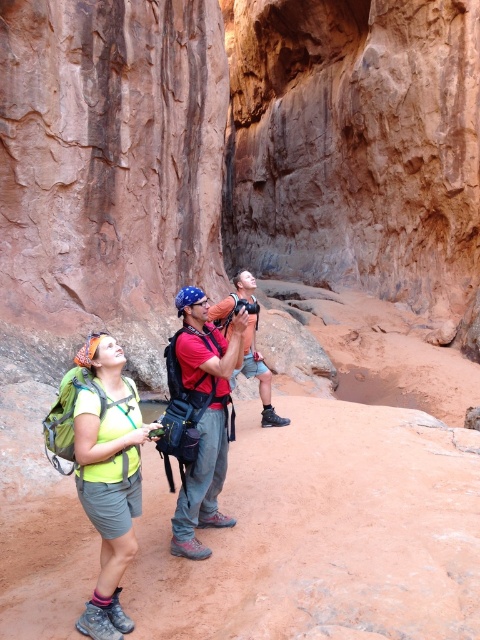
You are a photographer positioned at the entrance of the canyon. You want to take a photo of the matte red shirt at center and the matte orange tank top at center so that both are clearly visible in the frame. Given that your camera has a minimum focus distance of 1 meter, will you be able to capture both subjects without moving closer or farther away?

The matte red shirt at center is 1.31 meters from the matte orange tank top at center. Since the camera requires a minimum focus distance of 1 meter, the 1.31 meters between them exceeds this requirement. Therefore, both subjects can be captured clearly in the frame without adjusting your position.

Looking at this image, you are a photographer trying to capture a photo of the canyon walls. You have a camera on a tripod placed between the neon green fabric backpack at lower left and the matte red shirt at center. Which object is closer to the camera? Please explain your reasoning based on their positions.

The neon green fabric backpack at lower left is closer to the camera because it is positioned below the matte red shirt at center, meaning it is nearer to the camera placed between them.

You are a photographer trying to capture a group photo of the matte red shirt at center and the matte orange tank top at center. Which person should you focus on first if you want to ensure both are in the frame?

You should focus on the matte red shirt at center first because it is positioned under the matte orange tank top at center, so adjusting the camera angle to include both would require ensuring the lower one is framed properly first.